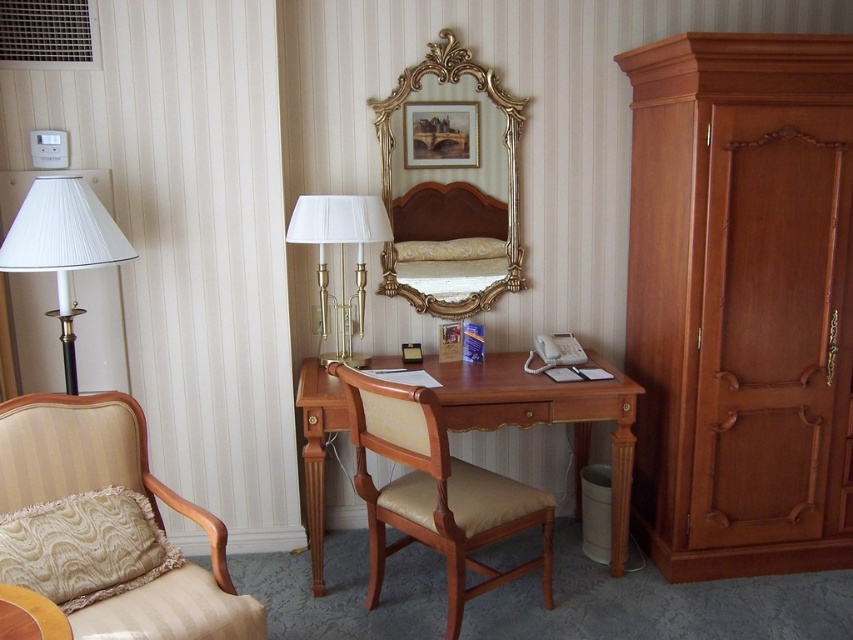
Where is `white pleated fabric lampshade at left`? Image resolution: width=853 pixels, height=640 pixels. white pleated fabric lampshade at left is located at coordinates (62, 248).

At what (x,y) coordinates should I click in order to perform the action: click on white pleated fabric lampshade at left. Please return your answer as a coordinate pair (x, y). Looking at the image, I should click on (62, 248).

Locate an element on the screen. The height and width of the screenshot is (640, 853). white pleated fabric lampshade at left is located at coordinates (62, 248).

Does matte brass lamp at center have a greater width compared to gold ornate picture frame at upper center?

Indeed, matte brass lamp at center has a greater width compared to gold ornate picture frame at upper center.

Does matte brass lamp at center have a lesser width compared to gold ornate picture frame at upper center?

No, matte brass lamp at center is not thinner than gold ornate picture frame at upper center.

Is point (363, 209) behind point (450, 145)?

That is False.

Find the location of a particular element. matte brass lamp at center is located at coordinates pyautogui.click(x=339, y=259).

Is beige fabric armchair at lower left further to the viewer compared to matte brass lamp at center?

That is False.

Consider the image. Does beige fabric armchair at lower left have a lesser width compared to matte brass lamp at center?

No, beige fabric armchair at lower left is not thinner than matte brass lamp at center.

What are the coordinates of `beige fabric armchair at lower left` in the screenshot? It's located at (105, 525).